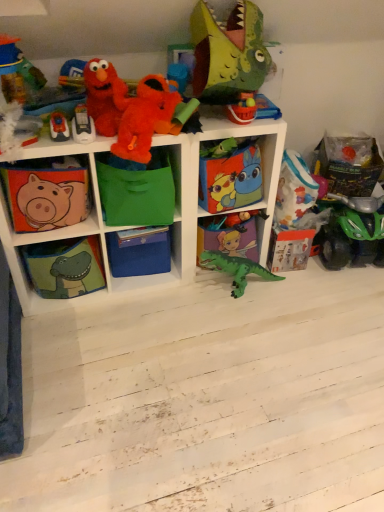
This screenshot has height=512, width=384. I want to click on empty space that is ontop of matte fabric piggy bank at left, the fifth shelf viewed from the right, so click(38, 162).